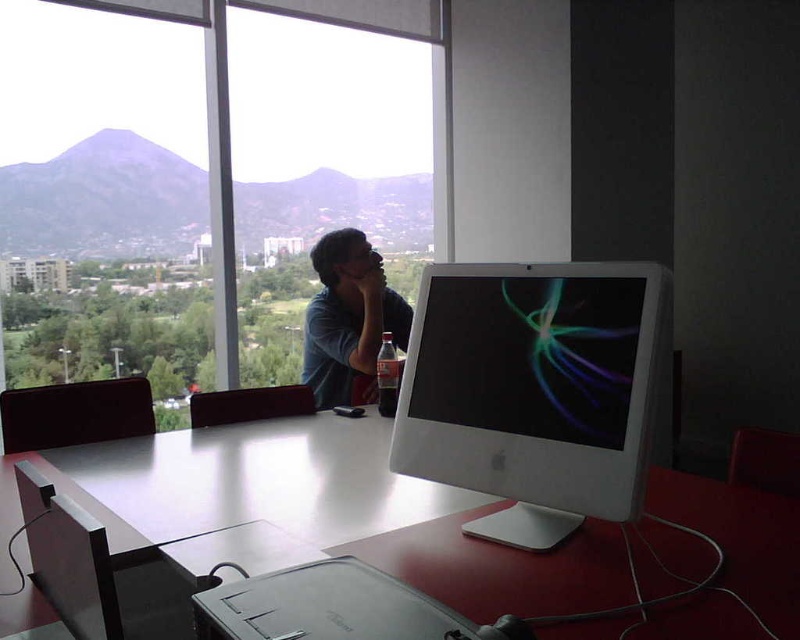
What do you see at coordinates (324, 509) in the screenshot? This screenshot has height=640, width=800. I see `white glossy table at center` at bounding box center [324, 509].

Is white glossy table at center wider than white glossy computer monitor at center?

Yes, white glossy table at center is wider than white glossy computer monitor at center.

In the scene shown: Who is more distant from viewer, (381,532) or (544,435)?

Point (381,532)

The width and height of the screenshot is (800, 640). In order to click on white glossy table at center in this screenshot , I will do [x=324, y=509].

Does point (197, 195) come farther from viewer compared to point (318, 77)?

No, it is not.

Who is more distant from viewer, (198, 156) or (426, 45)?

The point (426, 45) is behind.

This screenshot has height=640, width=800. I want to click on transparent glass window at upper center, so click(x=206, y=182).

Does white glossy computer monitor at center have a lesser width compared to matte blue shirt at center?

In fact, white glossy computer monitor at center might be wider than matte blue shirt at center.

Can you confirm if white glossy computer monitor at center is wider than matte blue shirt at center?

Indeed, white glossy computer monitor at center has a greater width compared to matte blue shirt at center.

Is point (430, 332) more distant than point (348, 371)?

No, (430, 332) is in front of (348, 371).

Image resolution: width=800 pixels, height=640 pixels. What are the coordinates of `white glossy computer monitor at center` in the screenshot? It's located at (532, 390).